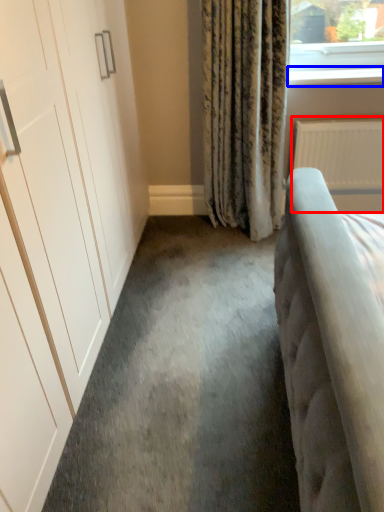
Question: Which point is further to the camera, radiator (highlighted by a red box) or window sill (highlighted by a blue box)?

Choices:
 (A) radiator
 (B) window sill

Answer: (A)